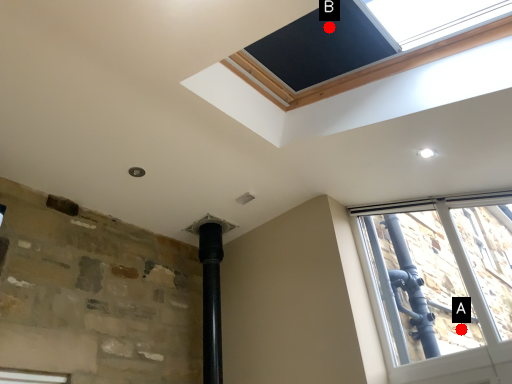
Question: Two points are circled on the image, labeled by A and B beside each circle. Which of the following is the closest to the observer?

Choices:
 (A) A is closer
 (B) B is closer

Answer: (B)